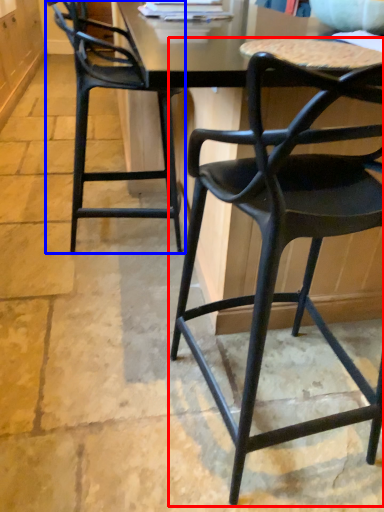
Question: Which object is further to the camera taking this photo, chair (highlighted by a red box) or chair (highlighted by a blue box)?

Choices:
 (A) chair
 (B) chair

Answer: (B)